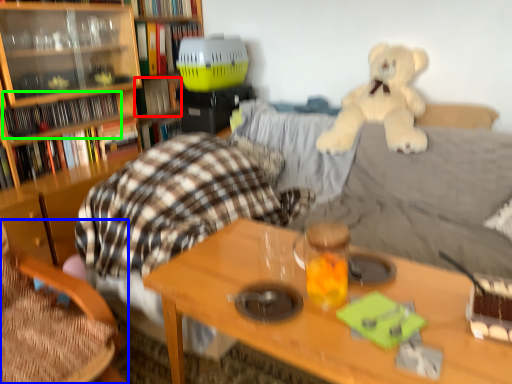
Question: Which object is the closest to the book (highlighted by a red box)? Choose among these: chair (highlighted by a blue box) or book (highlighted by a green box).

Choices:
 (A) chair
 (B) book

Answer: (B)